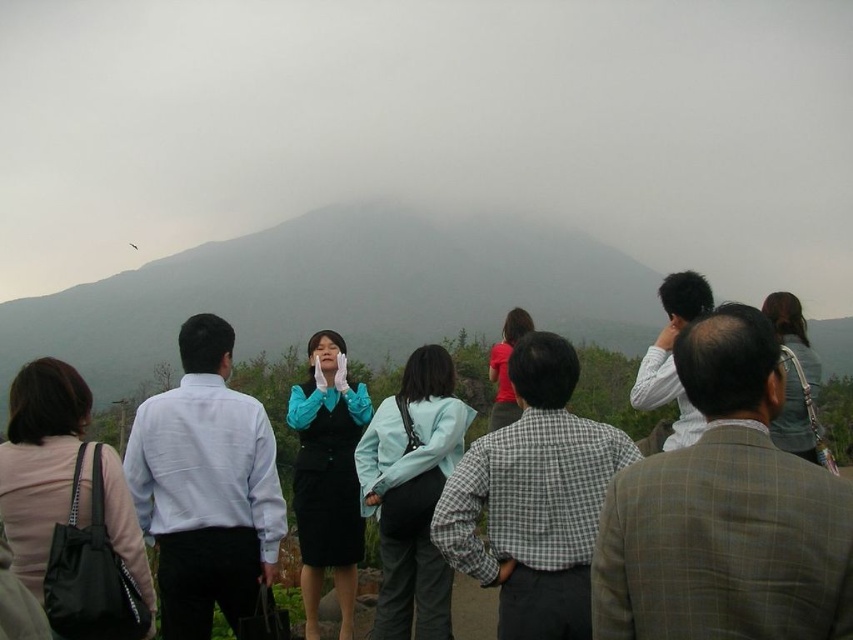
Question: Among these objects, which one is nearest to the camera?

Choices:
 (A) dark gray fabric jacket at upper right
 (B) plaid wool suit at right
 (C) foggy mountain at center
 (D) light blue fabric jacket at center

Answer: (B)

Question: Which of the following is the farthest from the observer?

Choices:
 (A) (512, 476)
 (B) (141, 435)
 (C) (344, 394)
 (D) (167, 282)

Answer: (D)

Question: Does green mossy hill at center come in front of white smooth shirt at left?

Choices:
 (A) yes
 (B) no

Answer: (B)

Question: Can you confirm if foggy mountain at center is smaller than matte blue suit at center?

Choices:
 (A) yes
 (B) no

Answer: (B)

Question: Which point is farther to the camera?

Choices:
 (A) (582, 323)
 (B) (378, 483)
 (C) (775, 308)

Answer: (A)

Question: Can you confirm if foggy mountain at center is wider than light blue fabric jacket at center?

Choices:
 (A) yes
 (B) no

Answer: (A)